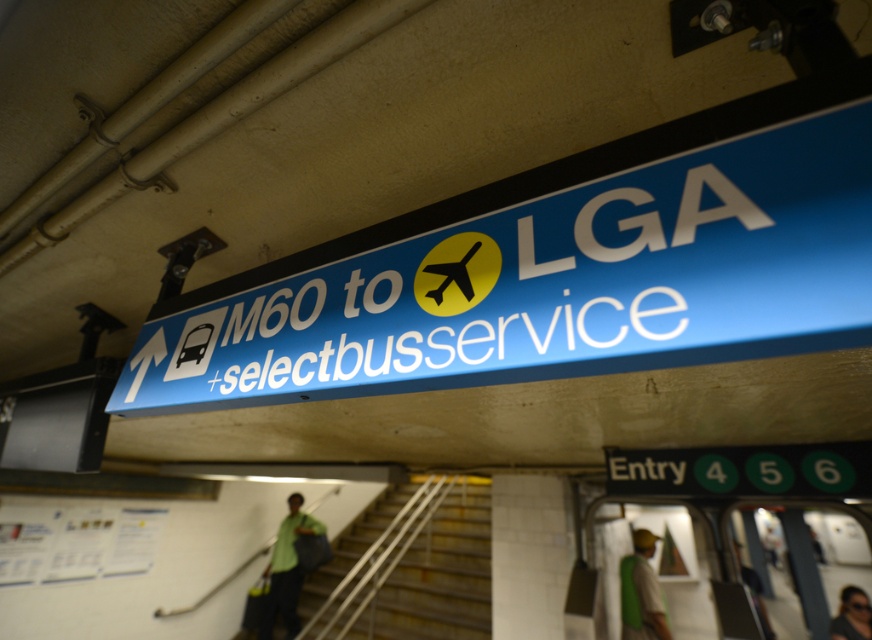
Which is in front, point (462, 564) or point (652, 612)?

Point (652, 612) is more forward.

Does metallic gray stairs at center have a larger size compared to green fabric bag at lower right?

Yes, metallic gray stairs at center is bigger than green fabric bag at lower right.

Between point (487, 547) and point (646, 600), which one is positioned in front?

Point (646, 600)

I want to click on metallic gray stairs at center, so click(x=409, y=568).

Is green matte shirt at lower center further to camera compared to green fabric shirt at lower right?

No, it is in front of green fabric shirt at lower right.

Is point (322, 532) positioned before point (753, 602)?

That is False.

Does point (281, 566) come closer to viewer compared to point (761, 602)?

Yes.

Locate an element on the screen. The width and height of the screenshot is (872, 640). green matte shirt at lower center is located at coordinates [285, 570].

Can you confirm if metallic gray stairs at center is positioned to the left of dark hair at upper right?

Indeed, metallic gray stairs at center is positioned on the left side of dark hair at upper right.

At what (x,y) coordinates should I click in order to perform the action: click on metallic gray stairs at center. Please return your answer as a coordinate pair (x, y). The image size is (872, 640). Looking at the image, I should click on (409, 568).